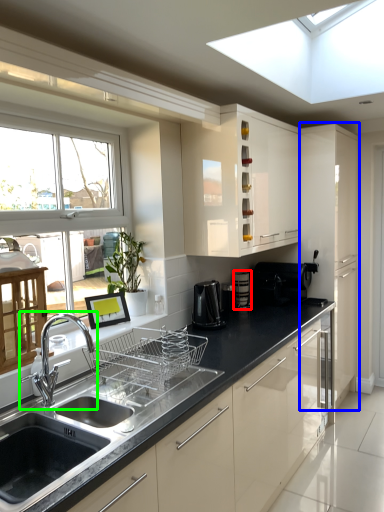
Question: Considering the real-world distances, which object is closest to appliance (highlighted by a red box)? cabinetry (highlighted by a blue box) or tap (highlighted by a green box).

Choices:
 (A) cabinetry
 (B) tap

Answer: (A)